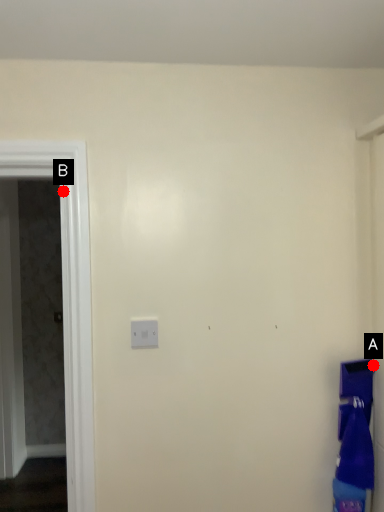
Question: Two points are circled on the image, labeled by A and B beside each circle. Which of the following is the farthest from the observer?

Choices:
 (A) A is further
 (B) B is further

Answer: (A)